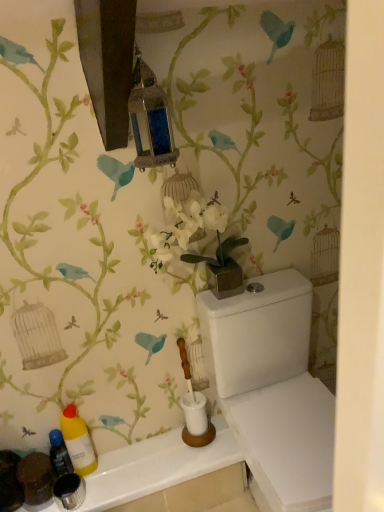
Question: Is white glossy porcelain at lower right oriented away from white glossy counter top at lower left?

Choices:
 (A) yes
 (B) no

Answer: (B)

Question: Can you confirm if white glossy porcelain at lower right is wider than white glossy counter top at lower left?

Choices:
 (A) no
 (B) yes

Answer: (B)

Question: Is white glossy porcelain at lower right touching white glossy counter top at lower left?

Choices:
 (A) no
 (B) yes

Answer: (A)

Question: Does white glossy porcelain at lower right lie behind white glossy counter top at lower left?

Choices:
 (A) no
 (B) yes

Answer: (A)

Question: Can you confirm if white glossy porcelain at lower right is positioned to the right of white glossy counter top at lower left?

Choices:
 (A) yes
 (B) no

Answer: (A)

Question: Can you confirm if white glossy porcelain at lower right is bigger than white glossy counter top at lower left?

Choices:
 (A) no
 (B) yes

Answer: (B)

Question: Is translucent plastic bottle at lower left, the first bottle viewed from the left, at the back of white glossy porcelain at lower right?

Choices:
 (A) yes
 (B) no

Answer: (B)

Question: Is white glossy porcelain at lower right positioned before translucent plastic bottle at lower left, the first bottle viewed from the left?

Choices:
 (A) no
 (B) yes

Answer: (B)

Question: Is white glossy porcelain at lower right bigger than translucent plastic bottle at lower left, the first bottle viewed from the left?

Choices:
 (A) yes
 (B) no

Answer: (A)

Question: From a real-world perspective, is white glossy porcelain at lower right beneath translucent plastic bottle at lower left, the 2th bottle when ordered from right to left?

Choices:
 (A) yes
 (B) no

Answer: (B)

Question: Is the surface of white glossy porcelain at lower right in direct contact with translucent plastic bottle at lower left, the 2th bottle when ordered from right to left?

Choices:
 (A) no
 (B) yes

Answer: (A)

Question: From the image's perspective, does white glossy porcelain at lower right appear lower than translucent plastic bottle at lower left, the first bottle viewed from the left?

Choices:
 (A) no
 (B) yes

Answer: (A)

Question: Considering the relative positions of translucent plastic bottle at lower left, the 2th bottle when ordered from right to left, and white glossy porcelain at lower right in the image provided, is translucent plastic bottle at lower left, the 2th bottle when ordered from right to left, in front of white glossy porcelain at lower right?

Choices:
 (A) yes
 (B) no

Answer: (B)